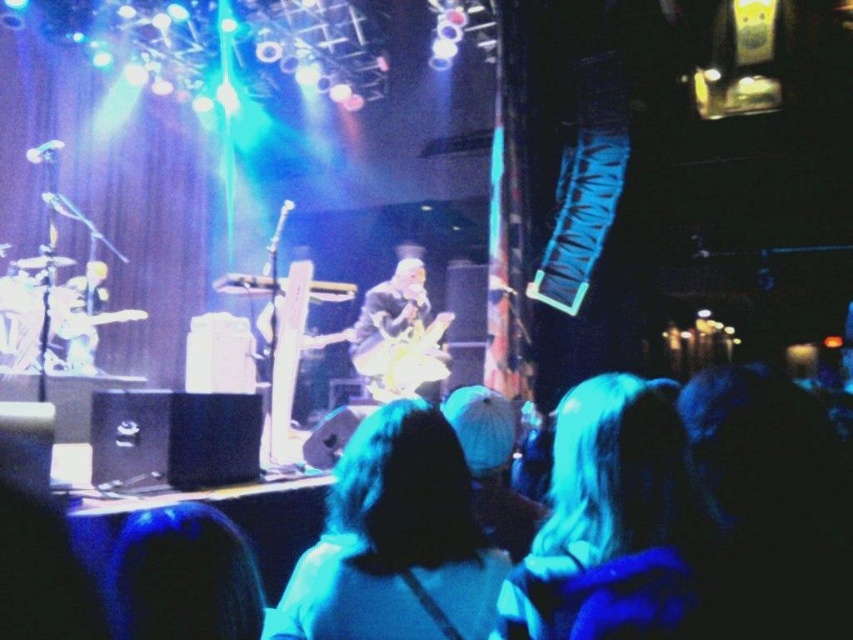
You are a photographer at the concert and want to capture a clear shot of both the light blue fabric at center and the shiny gold guitar at center. Since the stage is very crowded, you need to adjust your camera angle to ensure both objects are in focus. Which object should you focus on first to ensure the taller one is sharp?

The shiny gold guitar at center is taller than the light blue fabric at center. Therefore, you should focus on the shiny gold guitar at center first to ensure the taller object is sharp.

You are a stagehand preparing to adjust the lighting for the next song. You notice the light blue fabric at center and the shiny gold guitar at center. Which object should you focus on first if you need to adjust the lighting for the smaller object?

The light blue fabric at center is smaller than the shiny gold guitar at center, so you should focus on adjusting the lighting for the light blue fabric at center first.

You are a stagehand at the concert and need to place a new spotlight directly above the white fabric at center. Given that the stage coordinates are mapped from 0 to 1 in both x and y axes, can you determine the exact coordinates where you should position the spotlight?

The white fabric at center is located at coordinates point (604, 497), so the spotlight should be placed directly above it at the same x coordinate 0.777 and a slightly higher y coordinate, such as 0.75 to ensure proper illumination.